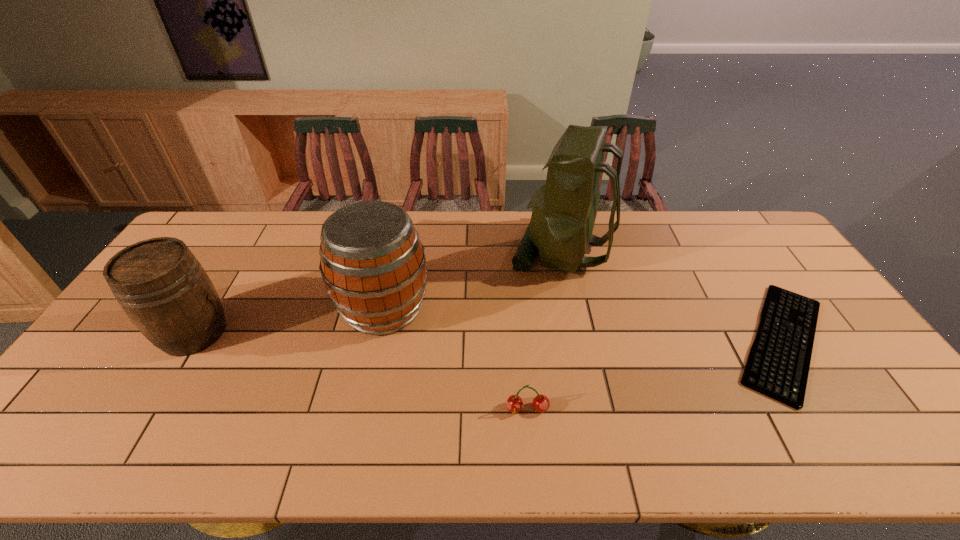
Image resolution: width=960 pixels, height=540 pixels. Identify the location of the tallest object. (564, 210).

The width and height of the screenshot is (960, 540). Identify the location of the right cider. (372, 262).

The height and width of the screenshot is (540, 960). Identify the location of the left cider. (163, 289).

The image size is (960, 540). I want to click on the third tallest object, so click(x=163, y=289).

Find the location of a particular element. This screenshot has height=540, width=960. the second shortest object is located at coordinates (541, 403).

Locate an element on the screen. the shortest object is located at coordinates (x=778, y=362).

Where is `computer keyboard`? computer keyboard is located at coordinates (778, 362).

Identify the location of vacant position located 0.290m on the front of the tallest object with visible pockets. This screenshot has width=960, height=540. (424, 249).

Identify the location of vacant space situated 0.300m on the front of the tallest object with visible pockets. (421, 249).

Locate an element on the screen. free space located on the front of the tallest object with visible pockets is located at coordinates (396, 249).